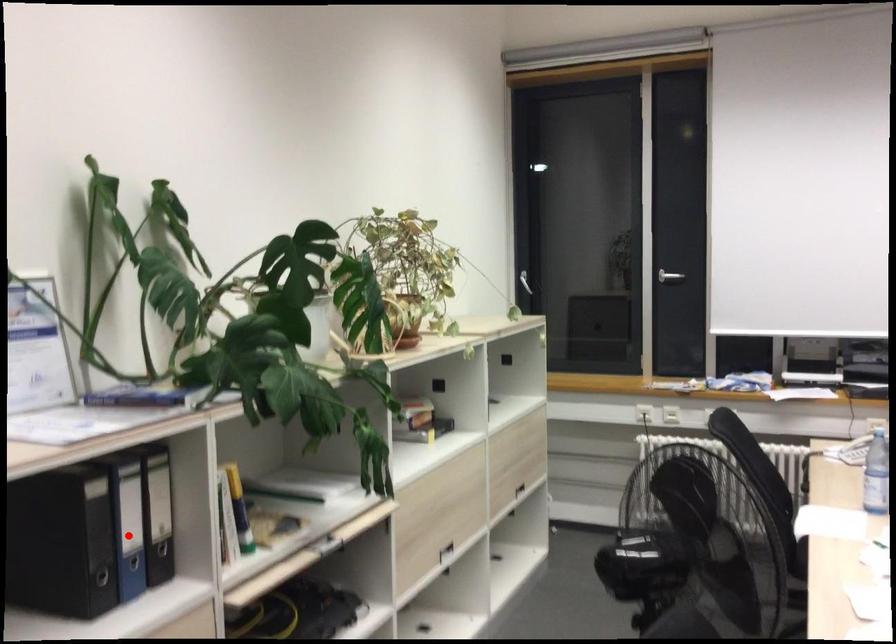
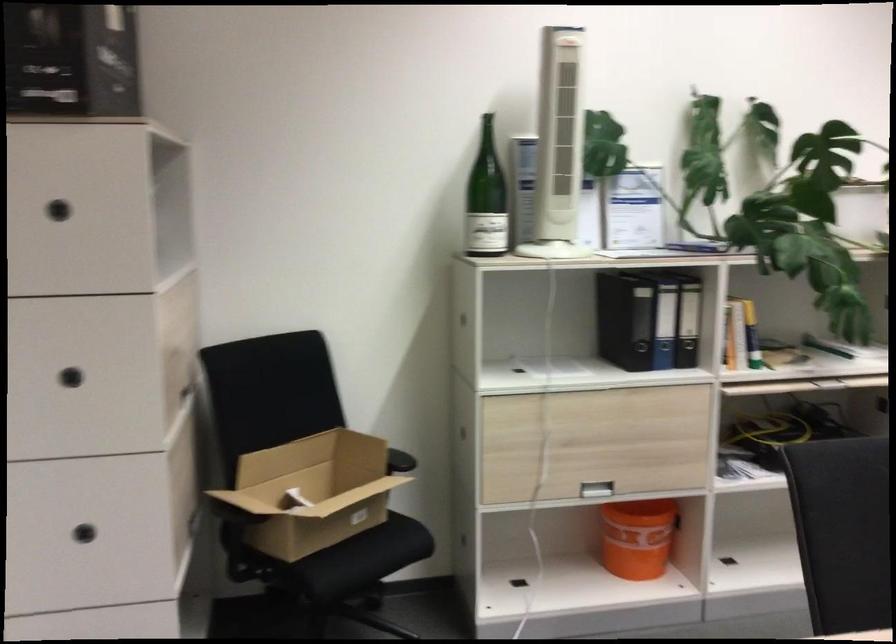
Question: I am providing you with two images of the same scene from different viewpoints. A red point is shown in image1. For the corresponding object point in image2, is it positioned nearer or farther from the camera?

Choices:
 (A) Nearer
 (B) Farther

Answer: (B)